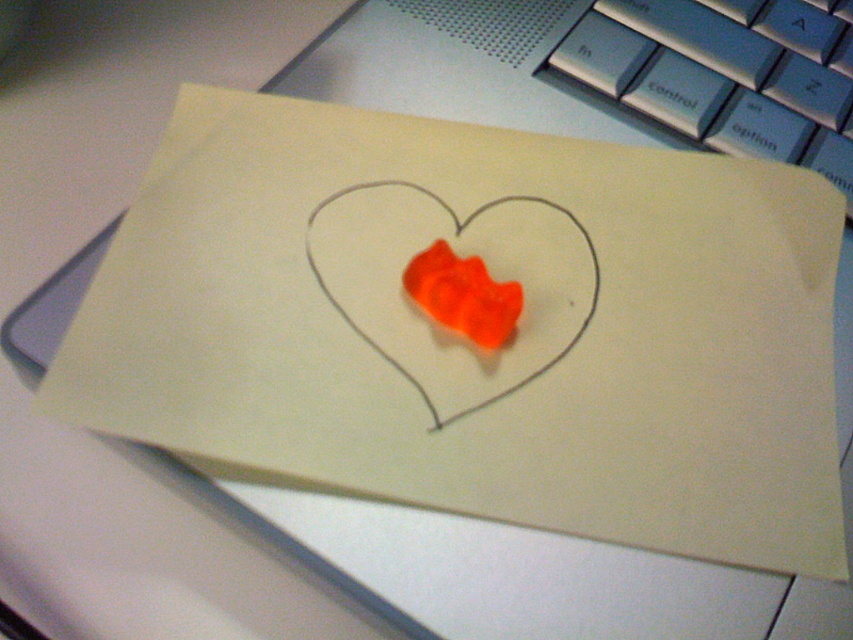
Which is above, orange gelatinous heart at center or translucent orange gummy bear at center?

orange gelatinous heart at center

Is point (422, 227) behind point (474, 269)?

That is True.

The height and width of the screenshot is (640, 853). I want to click on orange gelatinous heart at center, so click(457, 253).